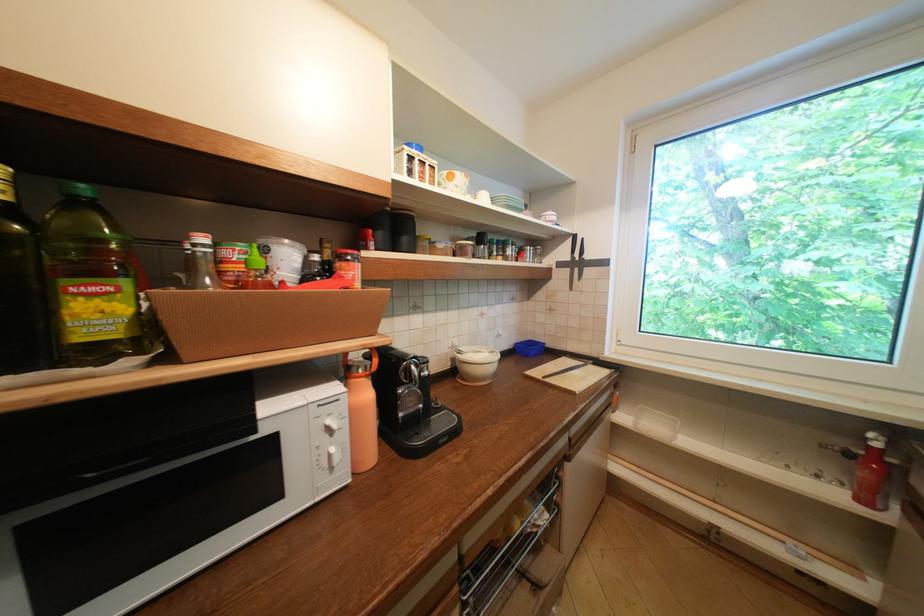
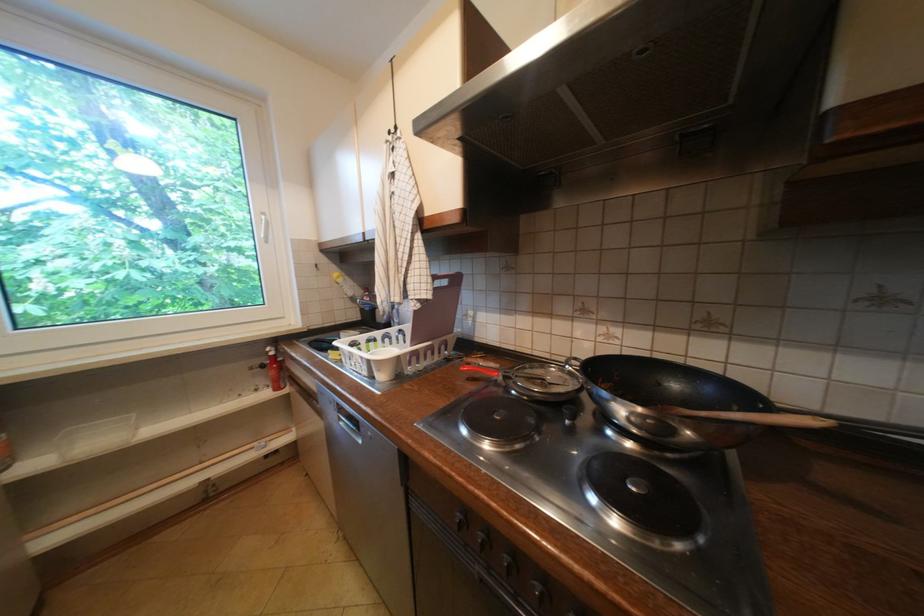
Question: The camera is either moving clockwise (left) or counter-clockwise (right) around the object. The first image is from the beginning of the video and the second image is from the end. Is the camera moving left or right when shooting the video?

Choices:
 (A) Left
 (B) Right

Answer: (A)